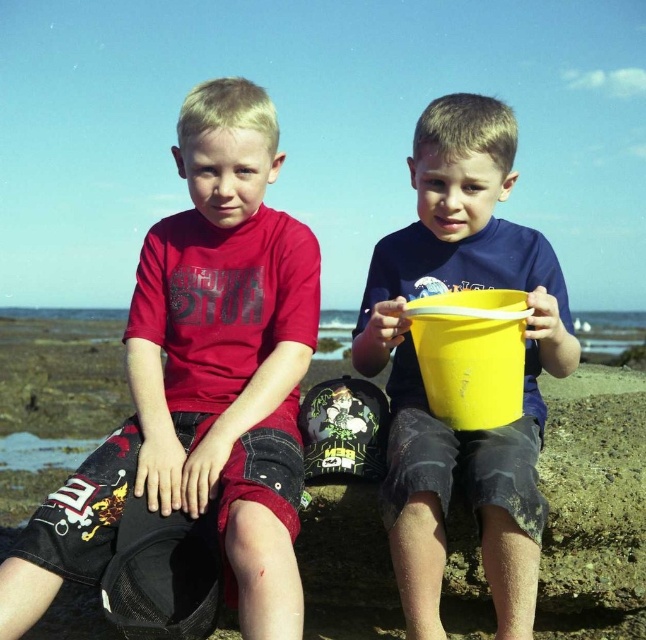
Between matte red t-shirt at left and yellow matte bucket at center, which one appears on the right side from the viewer's perspective?

From the viewer's perspective, yellow matte bucket at center appears more on the right side.

Who is higher up, matte red t-shirt at left or yellow matte bucket at center?

matte red t-shirt at left is higher up.

Which is in front, point (205, 403) or point (422, 554)?

Point (422, 554) is more forward.

At what (x,y) coordinates should I click in order to perform the action: click on matte red t-shirt at left. Please return your answer as a coordinate pair (x, y). Image resolution: width=646 pixels, height=640 pixels. Looking at the image, I should click on (202, 380).